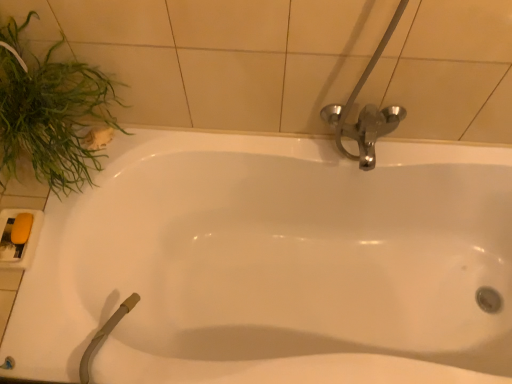
Question: Does white glossy bathtub at center have a greater height compared to yellow matte soap at lower left?

Choices:
 (A) yes
 (B) no

Answer: (A)

Question: Does white glossy bathtub at center have a lesser height compared to yellow matte soap at lower left?

Choices:
 (A) yes
 (B) no

Answer: (B)

Question: From the image's perspective, is white glossy bathtub at center under yellow matte soap at lower left?

Choices:
 (A) no
 (B) yes

Answer: (B)

Question: Is the surface of white glossy bathtub at center in direct contact with yellow matte soap at lower left?

Choices:
 (A) no
 (B) yes

Answer: (A)

Question: Is white glossy bathtub at center closer to camera compared to yellow matte soap at lower left?

Choices:
 (A) no
 (B) yes

Answer: (B)

Question: Is white glossy bathtub at center looking in the opposite direction of yellow matte soap at lower left?

Choices:
 (A) yes
 (B) no

Answer: (B)

Question: Can white glossy bathtub at center be found inside yellow matte soap at lower left?

Choices:
 (A) yes
 (B) no

Answer: (B)

Question: Does yellow matte soap at lower left appear on the right side of white glossy bathtub at center?

Choices:
 (A) yes
 (B) no

Answer: (B)

Question: Does yellow matte soap at lower left have a smaller size compared to white glossy bathtub at center?

Choices:
 (A) yes
 (B) no

Answer: (A)

Question: Does yellow matte soap at lower left have a lesser height compared to white glossy bathtub at center?

Choices:
 (A) yes
 (B) no

Answer: (A)

Question: From the image's perspective, is yellow matte soap at lower left on white glossy bathtub at center?

Choices:
 (A) yes
 (B) no

Answer: (A)

Question: Is yellow matte soap at lower left at the left side of white glossy bathtub at center?

Choices:
 (A) no
 (B) yes

Answer: (B)

Question: Is green leafy plant at left directly adjacent to white glossy bathtub at center?

Choices:
 (A) yes
 (B) no

Answer: (B)